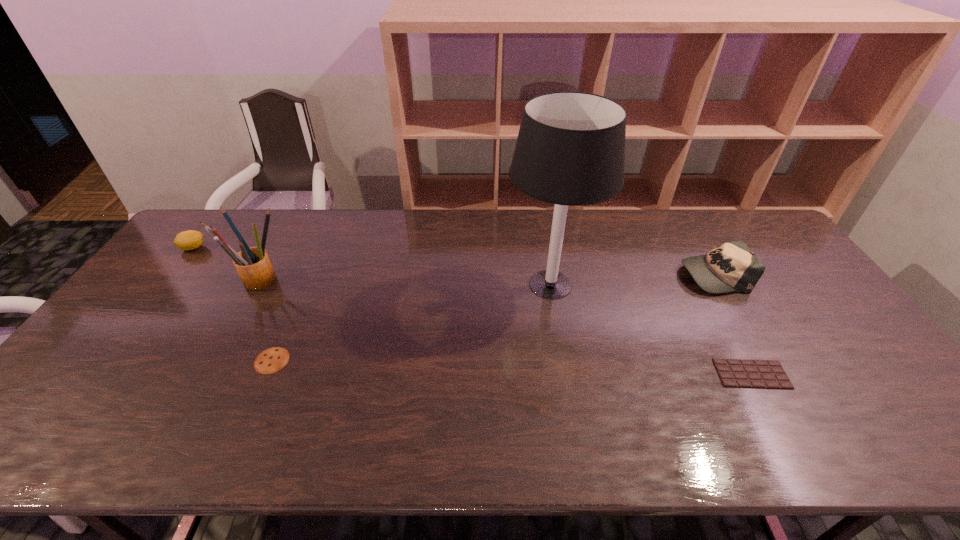
This screenshot has width=960, height=540. What are the coordinates of `vacant area situated 0.130m on the right of the tallest object` in the screenshot? It's located at pos(639,285).

The width and height of the screenshot is (960, 540). What are the coordinates of `free location located 0.060m on the left of the pencil box` in the screenshot? It's located at (213, 280).

Identify the location of vacant space situated 0.220m on the front-facing side of the baseball cap. (611, 274).

Identify the location of vacant space situated 0.160m on the front-facing side of the baseball cap. This screenshot has width=960, height=540. (630, 274).

Where is `vacant space located 0.150m on the front-facing side of the baseball cap`? The image size is (960, 540). vacant space located 0.150m on the front-facing side of the baseball cap is located at coordinates (633, 274).

Locate an element on the screen. vacant area located at the stem end of the lemon is located at coordinates (239, 248).

At what (x,y) coordinates should I click in order to perform the action: click on vacant space located 0.190m on the back of the fourth object from right to left. Please return your answer as a coordinate pair (x, y). This screenshot has height=540, width=960. Looking at the image, I should click on pos(300,296).

Where is `vacant area situated on the back of the chocolate bar`? The image size is (960, 540). vacant area situated on the back of the chocolate bar is located at coordinates (720, 316).

In order to click on object situated at the far edge in this screenshot , I will do `click(188, 240)`.

Locate an element on the screen. This screenshot has width=960, height=540. object that is at the left edge is located at coordinates (188, 240).